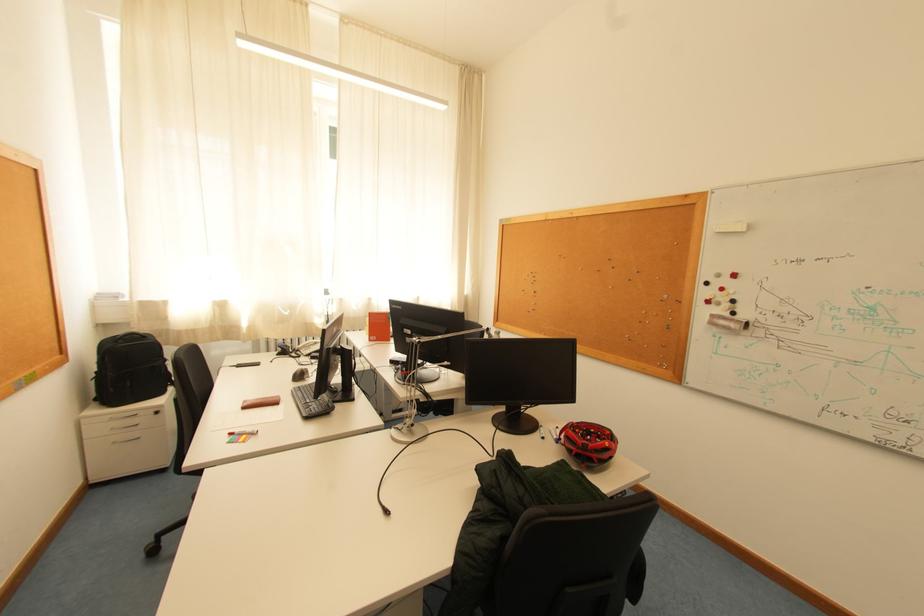
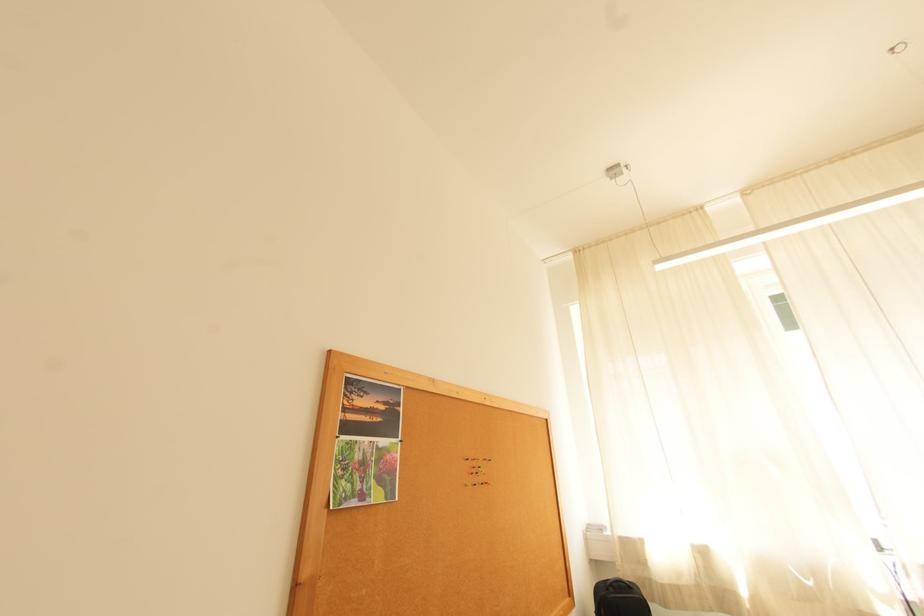
Looking at this image, the images are taken continuously from a first-person perspective. In which direction is your viewpoint rotating?

The camera rotated toward left-up.